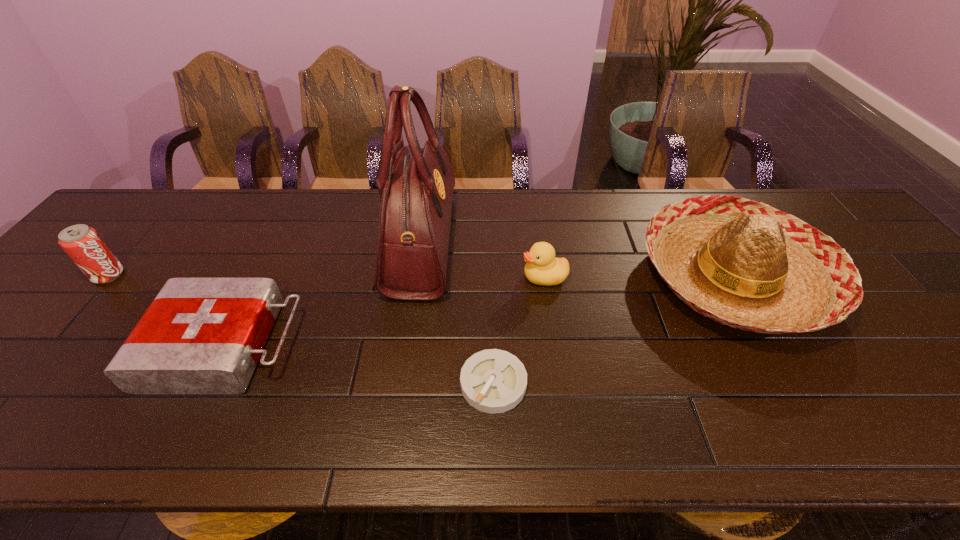
Where is `free area in between the rightmost object and the fifth object from right to left`? The width and height of the screenshot is (960, 540). free area in between the rightmost object and the fifth object from right to left is located at coordinates (480, 311).

Find the location of a particular element. free space between the fourth object from left to right and the fifth object from left to right is located at coordinates (518, 330).

This screenshot has width=960, height=540. What are the coordinates of `vacant area that lies between the second object from right to left and the fourth shortest object` in the screenshot? It's located at (326, 276).

Identify the location of vacant point located between the tallest object and the first-aid kit. The width and height of the screenshot is (960, 540). (324, 293).

This screenshot has height=540, width=960. In order to click on vacant area between the tallest object and the fifth object from right to left in this screenshot , I will do `click(324, 293)`.

The height and width of the screenshot is (540, 960). I want to click on vacant space in between the first-aid kit and the second object from right to left, so click(x=385, y=311).

This screenshot has height=540, width=960. In order to click on unoccupied area between the second object from right to left and the tallest object in this screenshot , I will do `click(483, 260)`.

Locate an element on the screen. This screenshot has height=540, width=960. unoccupied area between the fourth object from right to left and the second object from left to right is located at coordinates (324, 293).

Choose which object is the fourth nearest neighbor to the sombrero. Please provide its 2D coordinates. Your answer should be formatted as a tuple, i.e. [(x, y)], where the tuple contains the x and y coordinates of a point satisfying the conditions above.

[(200, 335)]

Choose which object is the second nearest neighbor to the second object from left to right. Please provide its 2D coordinates. Your answer should be formatted as a tuple, i.e. [(x, y)], where the tuple contains the x and y coordinates of a point satisfying the conditions above.

[(82, 243)]